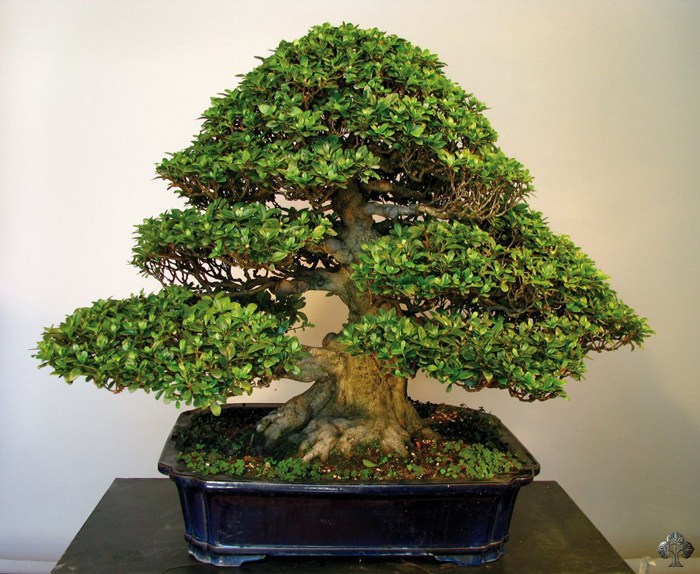
I want to click on white skirting board, so click(17, 565), click(633, 564).